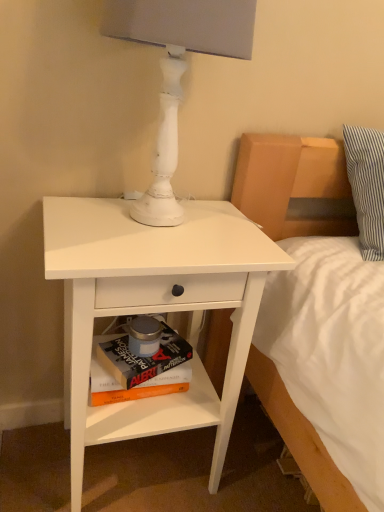
The height and width of the screenshot is (512, 384). I want to click on vacant space underneath white matte nightstand at lower left (from a real-world perspective), so click(x=144, y=470).